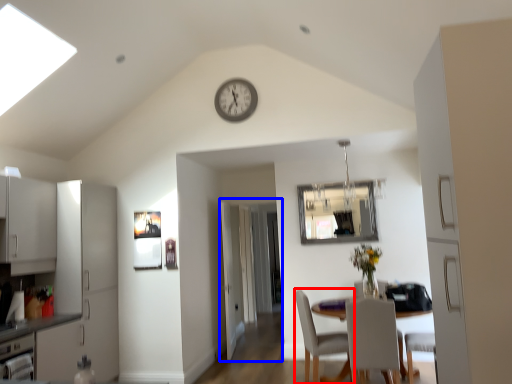
Question: Which of the following is the farthest to the observer, chair (highlighted by a red box) or glass door (highlighted by a blue box)?

Choices:
 (A) chair
 (B) glass door

Answer: (B)